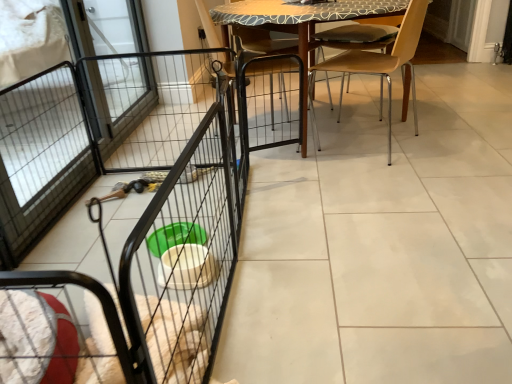
Question: Does black wire screen door at left contain light brown wood chair at center?

Choices:
 (A) yes
 (B) no

Answer: (B)

Question: Is black wire screen door at left directly adjacent to light brown wood chair at center?

Choices:
 (A) yes
 (B) no

Answer: (B)

Question: Is black wire screen door at left facing away from light brown wood chair at center?

Choices:
 (A) yes
 (B) no

Answer: (B)

Question: Is black wire screen door at left to the left of light brown wood chair at center from the viewer's perspective?

Choices:
 (A) no
 (B) yes

Answer: (B)

Question: Are black wire screen door at left and light brown wood chair at center located far from each other?

Choices:
 (A) no
 (B) yes

Answer: (B)

Question: From the image's perspective, is light brown wood chair at center located above or below black wire screen door at left?

Choices:
 (A) above
 (B) below

Answer: (B)

Question: Is light brown wood chair at center in front of or behind black wire screen door at left in the image?

Choices:
 (A) behind
 (B) front

Answer: (B)

Question: In terms of width, does light brown wood chair at center look wider or thinner when compared to black wire screen door at left?

Choices:
 (A) thin
 (B) wide

Answer: (B)

Question: From their relative heights in the image, would you say light brown wood chair at center is taller or shorter than black wire screen door at left?

Choices:
 (A) short
 (B) tall

Answer: (A)

Question: In the image, is light brown wood chair at center on the left side or the right side of black wire cage at center?

Choices:
 (A) left
 (B) right

Answer: (B)

Question: In the image, is light brown wood chair at center positioned in front of or behind black wire cage at center?

Choices:
 (A) behind
 (B) front

Answer: (A)

Question: From the image's perspective, is light brown wood chair at center above or below black wire cage at center?

Choices:
 (A) below
 (B) above

Answer: (B)

Question: Is light brown wood chair at center inside the boundaries of black wire cage at center, or outside?

Choices:
 (A) outside
 (B) inside

Answer: (A)

Question: In terms of height, does black wire screen door at left look taller or shorter compared to wooden chair at center?

Choices:
 (A) short
 (B) tall

Answer: (A)

Question: Is black wire screen door at left in front of or behind wooden chair at center in the image?

Choices:
 (A) front
 (B) behind

Answer: (B)